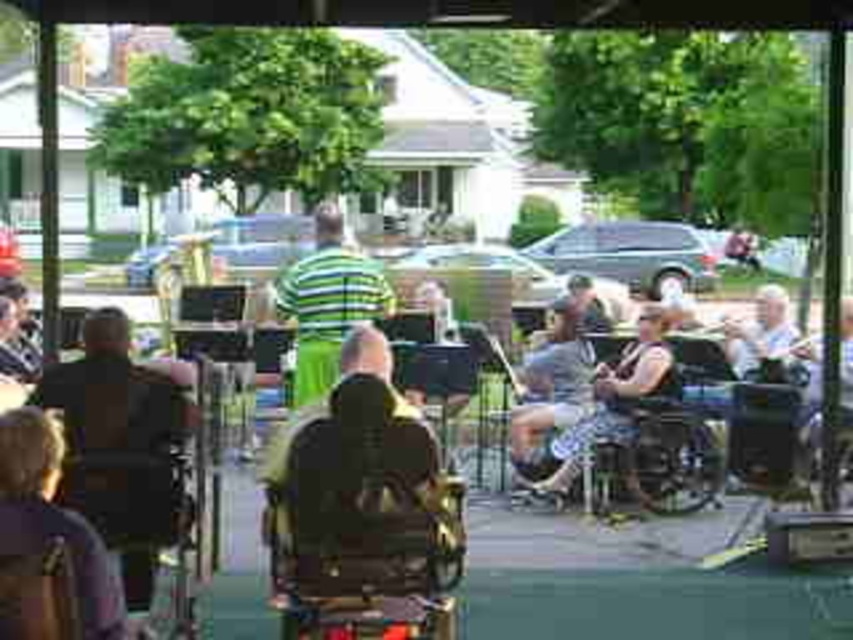
Which is behind, point (73, 496) or point (567, 371)?

The point (567, 371) is behind.

Is dark brown leather jacket at left positioned in front of camouflage shorts at center?

That is True.

Locate an element on the screen. This screenshot has width=853, height=640. dark brown leather jacket at left is located at coordinates (119, 445).

Does dark brown leather wheelchair at center have a lesser height compared to camouflage shorts at center?

Yes.

Between point (338, 524) and point (560, 410), which one is positioned in front?

Point (338, 524) is in front.

You are a GUI agent. You are given a task and a screenshot of the screen. Output one action in this format:
    pyautogui.click(x=<x>, y=<y>)
    Task: Click on the dark brown leather wheelchair at center
    
    Given the screenshot: What is the action you would take?
    pos(361,506)

Looking at this image, does dark brown leather jacket at left have a larger size compared to green striped shirt at center?

Actually, dark brown leather jacket at left might be smaller than green striped shirt at center.

Which is below, dark brown leather jacket at left or green striped shirt at center?

dark brown leather jacket at left is lower down.

What do you see at coordinates (119, 445) in the screenshot?
I see `dark brown leather jacket at left` at bounding box center [119, 445].

Find the location of a particular element. The width and height of the screenshot is (853, 640). dark brown leather jacket at left is located at coordinates (119, 445).